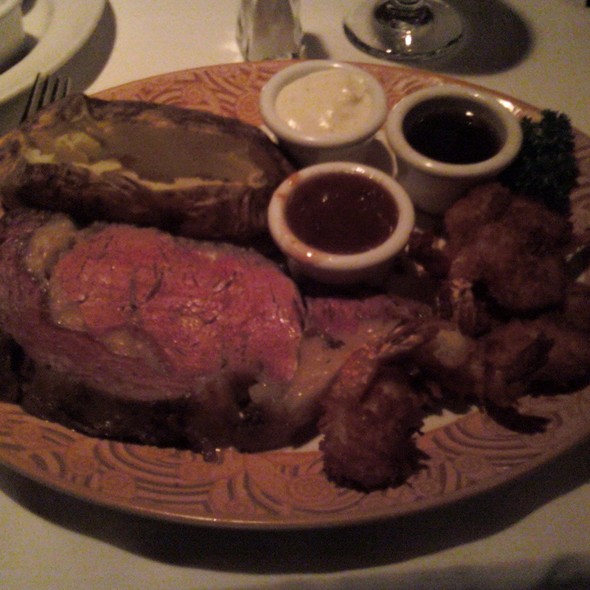
This screenshot has height=590, width=590. Find the location of `ramekin`. ramekin is located at coordinates (340, 143), (350, 260), (445, 172), (8, 25).